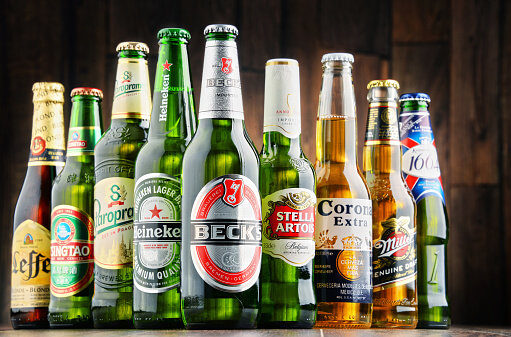
Find the location of a particular element. The width and height of the screenshot is (511, 337). beer bottles is located at coordinates (27, 235), (78, 259), (105, 249), (136, 253), (207, 249), (292, 234), (346, 230), (390, 231), (432, 232).